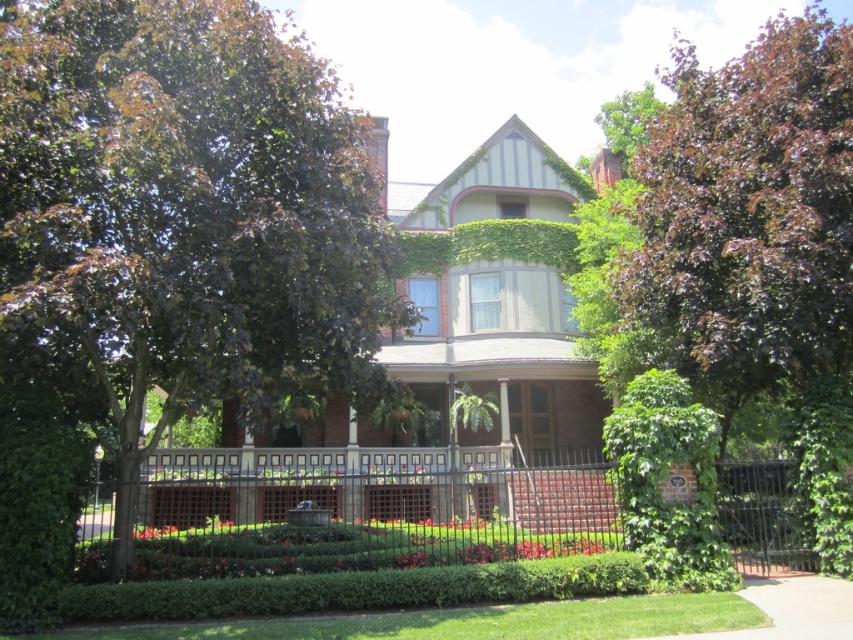
Question: Which point is farther from the camera taking this photo?

Choices:
 (A) (659, 548)
 (B) (36, 272)

Answer: (A)

Question: Is dark green leafy tree at upper left in front of green leafy bush at lower right?

Choices:
 (A) no
 (B) yes

Answer: (B)

Question: Which object appears closest to the camera in this image?

Choices:
 (A) black metal fence at center
 (B) dark green leafy tree at upper left

Answer: (B)

Question: Which point appears farthest from the camera in this image?

Choices:
 (A) (38, 317)
 (B) (639, 397)
 (C) (572, 513)

Answer: (C)

Question: Is dark green leafy tree at upper left positioned behind black metal fence at center?

Choices:
 (A) yes
 (B) no

Answer: (B)

Question: Can you confirm if dark green leafy tree at upper left is thinner than green leafy bush at lower right?

Choices:
 (A) no
 (B) yes

Answer: (A)